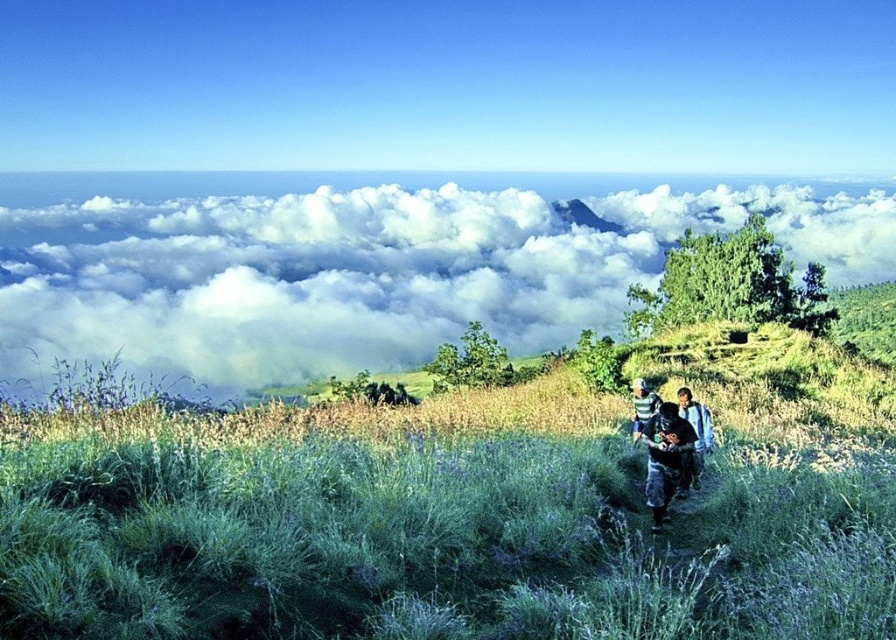
Is white fluffy cloud at upper center positioned at the back of blue denim jacket at lower right?

No.

Between white fluffy cloud at upper center and blue denim jacket at lower right, which one appears on the right side from the viewer's perspective?

Positioned to the right is white fluffy cloud at upper center.

This screenshot has height=640, width=896. I want to click on white fluffy cloud at upper center, so click(366, 262).

Identify the location of white fluffy cloud at upper center. Image resolution: width=896 pixels, height=640 pixels. (366, 262).

Which of these two, white fluffy cloud at upper center or striped cotton shirt at center, stands shorter?

Standing shorter between the two is striped cotton shirt at center.

Can you confirm if white fluffy cloud at upper center is taller than striped cotton shirt at center?

Yes, white fluffy cloud at upper center is taller than striped cotton shirt at center.

The width and height of the screenshot is (896, 640). Identify the location of white fluffy cloud at upper center. (366, 262).

This screenshot has height=640, width=896. I want to click on white fluffy cloud at upper center, so click(366, 262).

Can you confirm if striped cotton shirt at center is wider than striped fabric shirt at center?

No, striped cotton shirt at center is not wider than striped fabric shirt at center.

Does point (688, 400) come behind point (633, 397)?

That is False.

This screenshot has height=640, width=896. What do you see at coordinates (672, 451) in the screenshot?
I see `striped cotton shirt at center` at bounding box center [672, 451].

Locate an element on the screen. The height and width of the screenshot is (640, 896). striped cotton shirt at center is located at coordinates (672, 451).